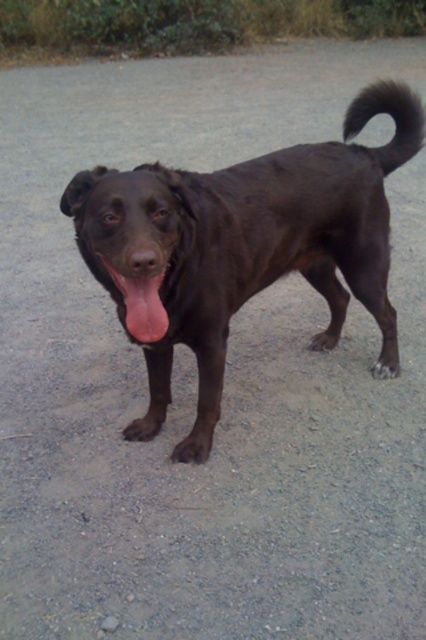
In the scene described, there is a chocolate Labrador Retriever and a shiny black dog at center represented by point (247,244). Are both dogs present in the image?

The scene describes a chocolate Labrador Retriever, but the Objects Description specifies that the point (247,244) represents a shiny black dog at center. Therefore, both dogs are present in the image.

You are standing at point A located at coordinates point A at (183, 305). You want to walk to point B, which is 7.26 feet away from point A. How many steps would you need to take if each step covers 2.4 feet?

The distance between point A at (183, 305) and point B is 7.26 feet. Since each step covers 2.4 feet, dividing 7.26 by 2.4 gives approximately 3 steps. However, since 3 steps would cover 7.2 feet, leaving a remaining 0.06 feet, you would need to take 4 steps to reach point B.